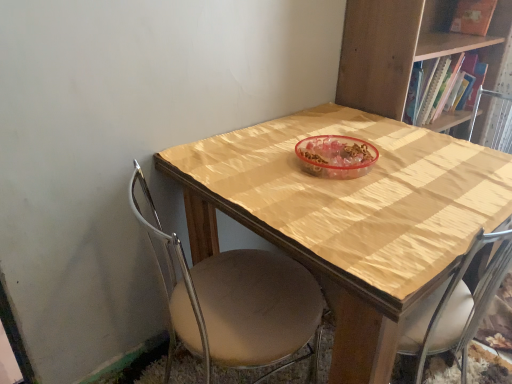
Question: Does wooden bookcase at upper right contain wooden table at center?

Choices:
 (A) yes
 (B) no

Answer: (B)

Question: Does wooden bookcase at upper right come in front of wooden table at center?

Choices:
 (A) yes
 (B) no

Answer: (B)

Question: Is wooden bookcase at upper right smaller than wooden table at center?

Choices:
 (A) no
 (B) yes

Answer: (B)

Question: Does wooden bookcase at upper right have a lesser height compared to wooden table at center?

Choices:
 (A) no
 (B) yes

Answer: (B)

Question: Can you confirm if wooden bookcase at upper right is positioned to the left of wooden table at center?

Choices:
 (A) no
 (B) yes

Answer: (A)

Question: Is wooden bookcase at upper right further to the viewer compared to wooden table at center?

Choices:
 (A) yes
 (B) no

Answer: (A)

Question: From a real-world perspective, is matte orange book at upper right located higher than wooden table at center?

Choices:
 (A) no
 (B) yes

Answer: (B)

Question: Is wooden table at center completely or partially inside matte orange book at upper right?

Choices:
 (A) yes
 (B) no

Answer: (B)

Question: Does matte orange book at upper right have a smaller size compared to wooden table at center?

Choices:
 (A) no
 (B) yes

Answer: (B)

Question: Could you tell me if matte orange book at upper right is turned towards wooden table at center?

Choices:
 (A) no
 (B) yes

Answer: (A)

Question: Considering the relative sizes of matte orange book at upper right and wooden table at center in the image provided, is matte orange book at upper right shorter than wooden table at center?

Choices:
 (A) no
 (B) yes

Answer: (B)

Question: Is matte orange book at upper right in contact with wooden table at center?

Choices:
 (A) yes
 (B) no

Answer: (B)

Question: Does beige fabric chair at center turn towards wooden table at center?

Choices:
 (A) no
 (B) yes

Answer: (B)